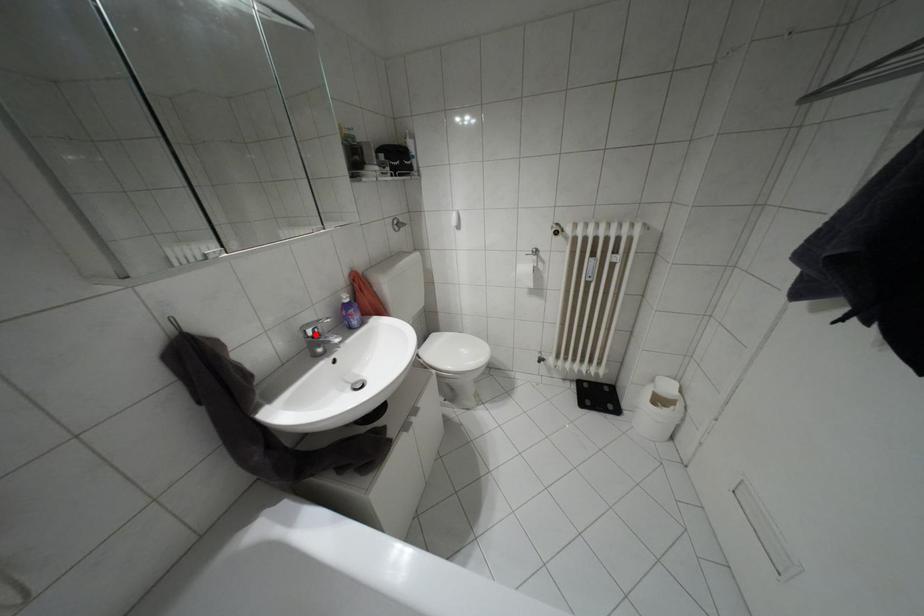
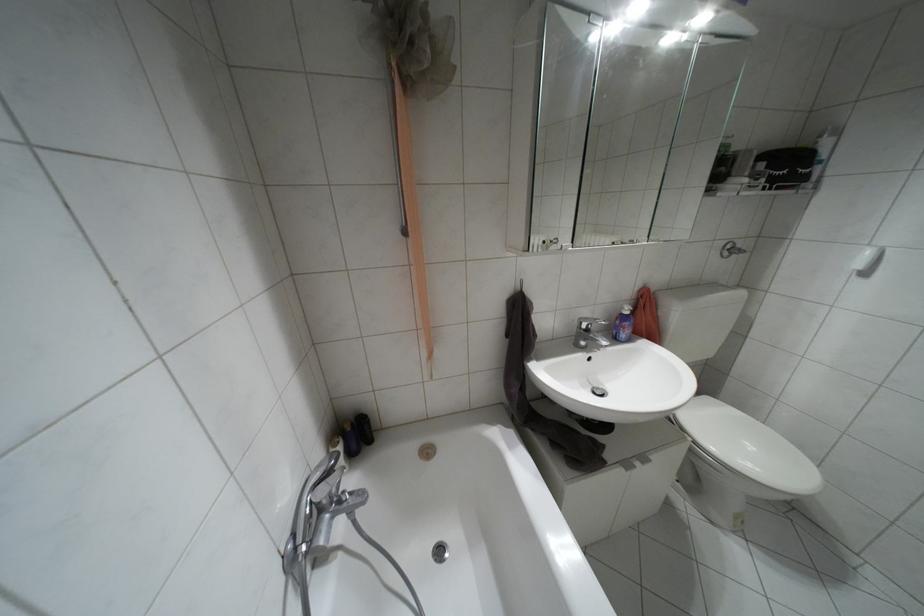
In the second image, find the point that corresponds to the highlighted location in the first image.

(587, 330)